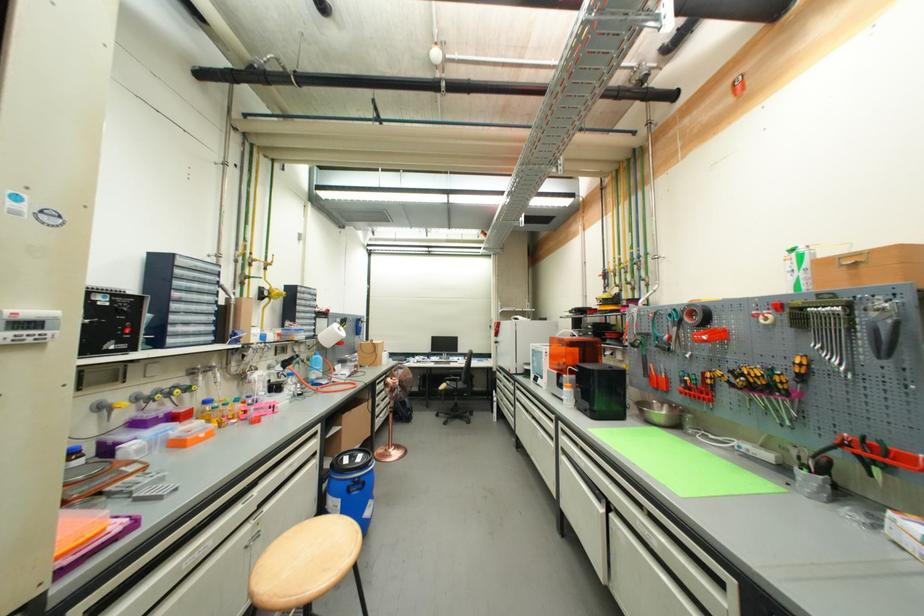
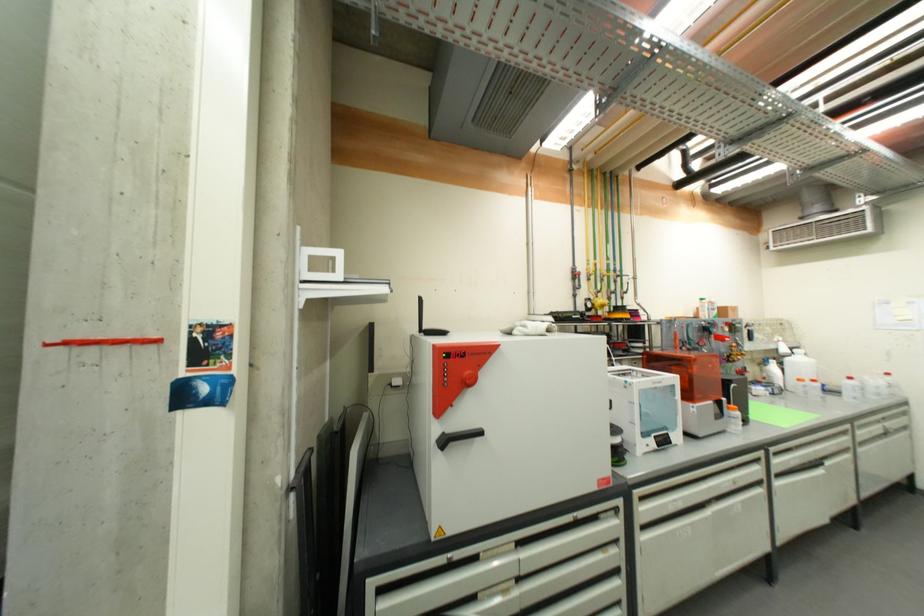
The point at (509,378) is marked in the first image. Where is the corresponding point in the second image?

(525, 546)